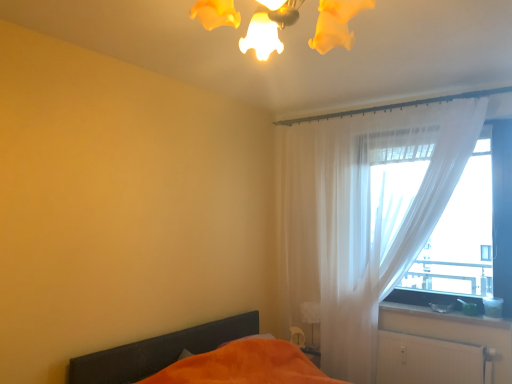
Question: Can you confirm if orange fabric bed at lower left is taller than white glossy table lamp at lower right?

Choices:
 (A) no
 (B) yes

Answer: (B)

Question: Is the depth of orange fabric bed at lower left greater than that of white glossy table lamp at lower right?

Choices:
 (A) no
 (B) yes

Answer: (A)

Question: Is white glossy table lamp at lower right surrounded by orange fabric bed at lower left?

Choices:
 (A) no
 (B) yes

Answer: (A)

Question: From the image's perspective, is orange fabric bed at lower left above white glossy table lamp at lower right?

Choices:
 (A) no
 (B) yes

Answer: (A)

Question: Is orange fabric bed at lower left not near white glossy table lamp at lower right?

Choices:
 (A) no
 (B) yes

Answer: (A)

Question: Is orange fabric bed at lower left with white glossy table lamp at lower right?

Choices:
 (A) no
 (B) yes

Answer: (A)

Question: Is smooth white surface at lower right located within orange fabric bed at lower left?

Choices:
 (A) yes
 (B) no

Answer: (B)

Question: Is orange fabric bed at lower left bigger than smooth white surface at lower right?

Choices:
 (A) yes
 (B) no

Answer: (A)

Question: Is orange fabric bed at lower left at the right side of smooth white surface at lower right?

Choices:
 (A) no
 (B) yes

Answer: (A)

Question: Does orange fabric bed at lower left have a lesser width compared to smooth white surface at lower right?

Choices:
 (A) yes
 (B) no

Answer: (B)

Question: Is orange fabric bed at lower left positioned far away from smooth white surface at lower right?

Choices:
 (A) no
 (B) yes

Answer: (B)

Question: From a real-world perspective, does orange fabric bed at lower left stand above smooth white surface at lower right?

Choices:
 (A) yes
 (B) no

Answer: (B)

Question: Is smooth white surface at lower right to the left of white textured radiator at lower right from the viewer's perspective?

Choices:
 (A) yes
 (B) no

Answer: (B)